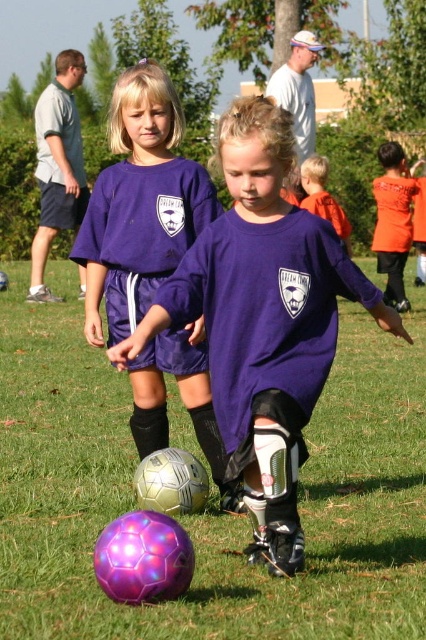
You are a soccer coach observing the practice. You notice two points marked on the field at coordinates point (129, 209) and point (377, 224). Which point is closer to the soccer ball that the child in front is kicking?

Point (129, 209) is in front of point (377, 224), so it is closer to the soccer ball that the child in front is kicking.

You are a soccer coach observing the practice. You notice a point at coordinates (x=262, y=321). Which object is this point located on?

The point at coordinates (x=262, y=321) is located on the purple matte soccer ball at lower left.

You are a photographer trying to capture a photo of the orange matte shirt at upper right and the green grass at center. Which object is closer to the camera?

The orange matte shirt at upper right is closer to the camera because the green grass at center is positioned under it, indicating it is behind.